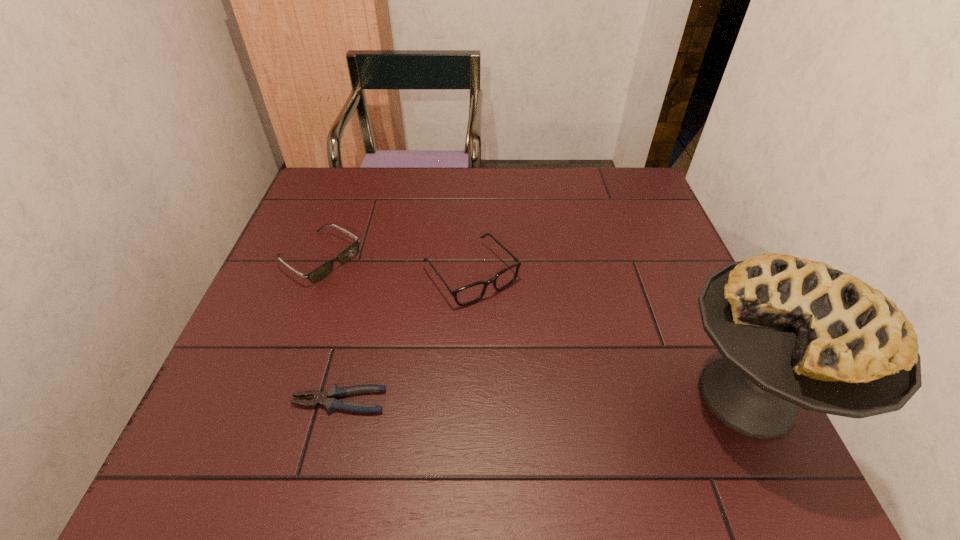
Image resolution: width=960 pixels, height=540 pixels. Find the location of `pliers`. pliers is located at coordinates (328, 399).

The width and height of the screenshot is (960, 540). What are the coordinates of `the tallest object` in the screenshot? It's located at (792, 332).

The height and width of the screenshot is (540, 960). What are the coordinates of `the rightmost object` in the screenshot? It's located at (792, 332).

The height and width of the screenshot is (540, 960). Find the location of `sunglasses`. sunglasses is located at coordinates [323, 270].

Where is `the second tallest object`? The width and height of the screenshot is (960, 540). the second tallest object is located at coordinates (471, 293).

Where is `the second object from right to left`? the second object from right to left is located at coordinates (471, 293).

Where is `vacant space located at the gripping part of the pliers`? The image size is (960, 540). vacant space located at the gripping part of the pliers is located at coordinates (227, 401).

You are a GUI agent. You are given a task and a screenshot of the screen. Output one action in this format:
    pyautogui.click(x=<x>, y=<y>)
    Task: Click on the vacant space located at the gripping part of the pliers
    This screenshot has height=540, width=960.
    Given the screenshot: What is the action you would take?
    click(227, 401)

Identify the location of vacant space situated 0.330m on the cut side of the tallest object. This screenshot has width=960, height=540. (496, 397).

Find the location of a particular element. free space located 0.070m on the cut side of the tallest object is located at coordinates (630, 397).